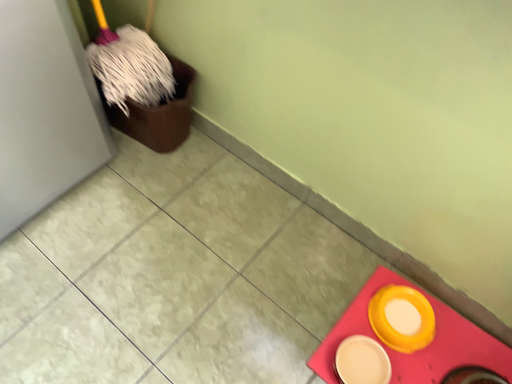
The width and height of the screenshot is (512, 384). I want to click on free space behind yellow matte bowl at lower right, the first tableware in the right-to-left sequence, so click(x=368, y=267).